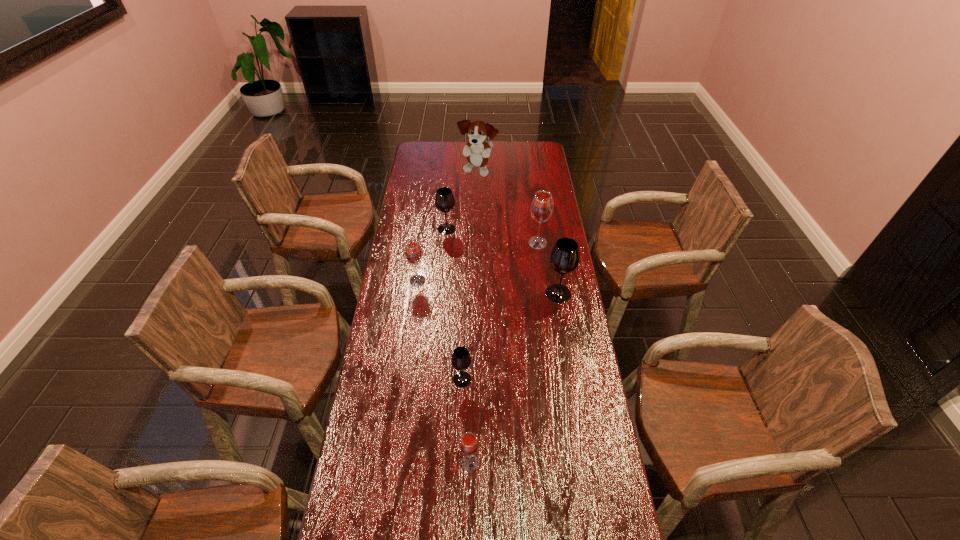
Point out which gray wineglass is positioned as the third nearest to the farthest red wineglass. Please provide its 2D coordinates. Your answer should be formatted as a tuple, i.e. [(x, y)], where the tuple contains the x and y coordinates of a point satisfying the conditions above.

[(461, 360)]

You are a GUI agent. You are given a task and a screenshot of the screen. Output one action in this format:
    pyautogui.click(x=<x>, y=<y>)
    Task: Click on the closest gray wineglass to the rightmost red wineglass
    Image resolution: width=960 pixels, height=540 pixels.
    Given the screenshot: What is the action you would take?
    pyautogui.click(x=564, y=258)

This screenshot has width=960, height=540. I want to click on free space in the image that satisfies the following two spatial constraints: 1. on the front side of the third farthest object; 2. on the right side of the biggest gray wineglass, so click(544, 294).

The image size is (960, 540). I want to click on free space in the image that satisfies the following two spatial constraints: 1. on the face of the fifth nearest object; 2. on the right side of the puppy, so click(x=477, y=243).